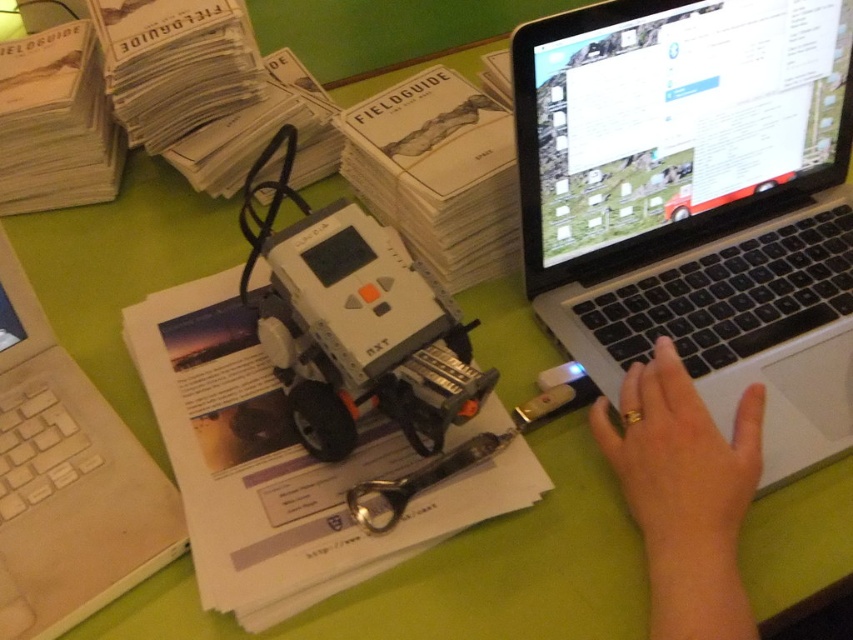
You are a student trying to locate the point at coordinates (695,202) on the image. Based on the scene description, where would this point be located?

The point at coordinates (695,202) is located on the silver and black laptop at the right side of the image.